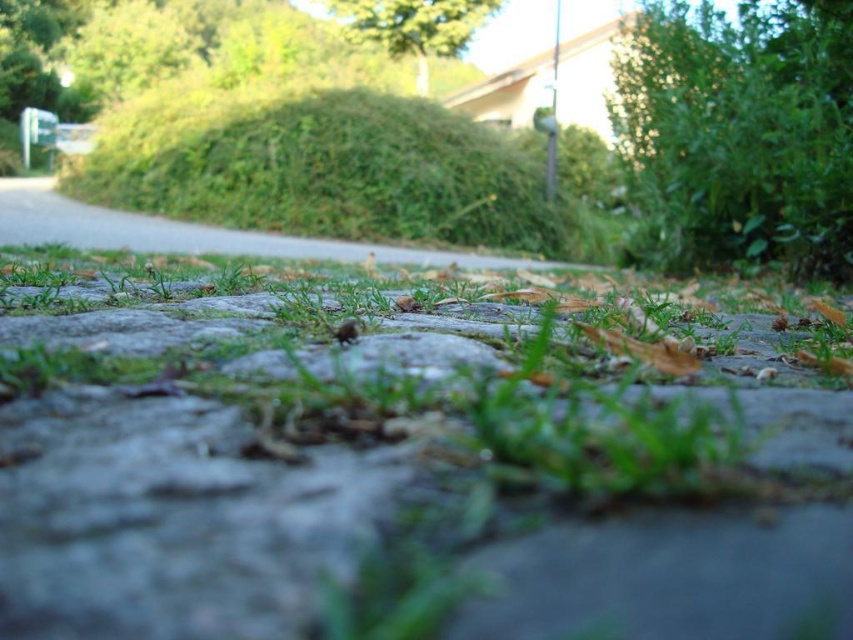
Does green grass at center appear on the right side of green leafy grass at center?

Yes, green grass at center is to the right of green leafy grass at center.

Which is in front, point (201, 465) or point (451, 189)?

Point (201, 465)

Between point (836, 512) and point (486, 179), which one is positioned behind?

Point (486, 179)

This screenshot has height=640, width=853. I want to click on green grass at center, so click(x=408, y=460).